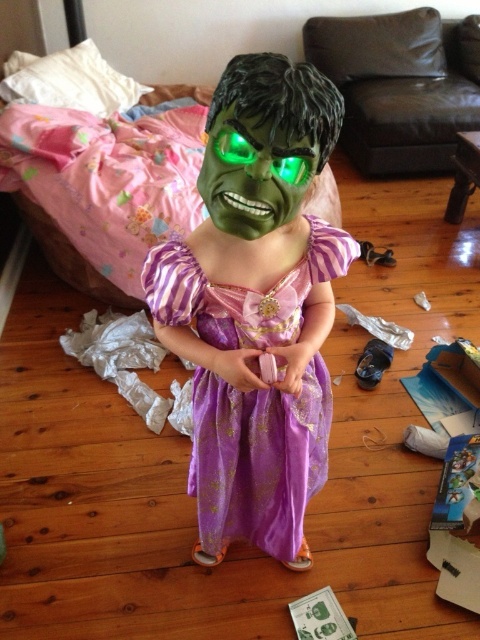
Question: Which of the following is the farthest from the observer?

Choices:
 (A) (238, 172)
 (B) (308, 472)

Answer: (B)

Question: Among these objects, which one is farthest from the camera?

Choices:
 (A) green matte mask at center
 (B) purple satin dress at center

Answer: (B)

Question: Does purple satin dress at center lie behind green matte mask at center?

Choices:
 (A) yes
 (B) no

Answer: (A)

Question: Is purple satin dress at center smaller than green matte mask at center?

Choices:
 (A) yes
 (B) no

Answer: (B)

Question: Is purple satin dress at center in front of green matte mask at center?

Choices:
 (A) no
 (B) yes

Answer: (A)